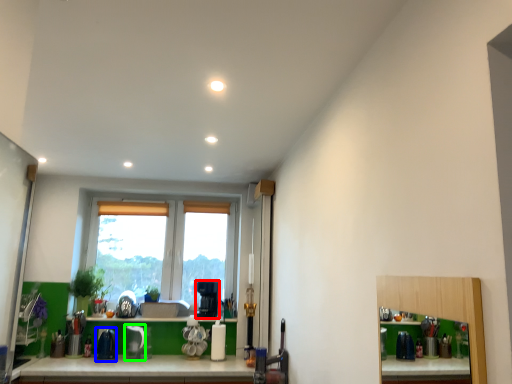
Question: Which object is positioned farthest from coffee machine (highlighted by a red box)? Select from appliance (highlighted by a blue box) and appliance (highlighted by a green box).

Choices:
 (A) appliance
 (B) appliance

Answer: (A)